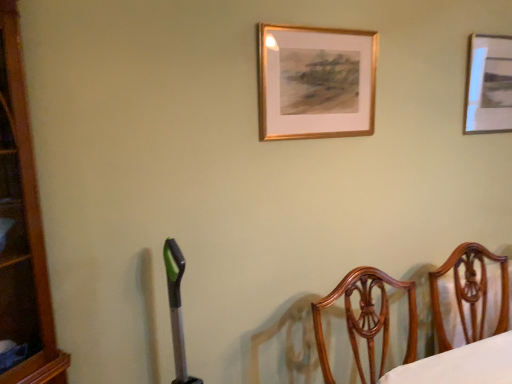
Question: From the image's perspective, is wooden chair at right under gold wooden picture frame at upper center, the 2th picture frame positioned from the right?

Choices:
 (A) no
 (B) yes

Answer: (B)

Question: Can you confirm if wooden chair at right is smaller than gold wooden picture frame at upper center, the 2th picture frame positioned from the right?

Choices:
 (A) yes
 (B) no

Answer: (B)

Question: Is wooden chair at right facing away from gold wooden picture frame at upper center, the second picture frame when ordered from back to front?

Choices:
 (A) yes
 (B) no

Answer: (B)

Question: Is wooden chair at right behind gold wooden picture frame at upper center, the 2th picture frame positioned from the right?

Choices:
 (A) yes
 (B) no

Answer: (B)

Question: Considering the relative positions of wooden chair at right and gold wooden picture frame at upper center, the 2th picture frame positioned from the right, in the image provided, is wooden chair at right to the left of gold wooden picture frame at upper center, the 2th picture frame positioned from the right, from the viewer's perspective?

Choices:
 (A) yes
 (B) no

Answer: (B)

Question: Is wooden chair at right not inside gold wooden picture frame at upper center, the second picture frame when ordered from back to front?

Choices:
 (A) no
 (B) yes

Answer: (B)

Question: Considering the relative positions of gold wooden picture frame at upper center, the second picture frame when ordered from back to front, and wooden chair at right in the image provided, is gold wooden picture frame at upper center, the second picture frame when ordered from back to front, to the left of wooden chair at right from the viewer's perspective?

Choices:
 (A) no
 (B) yes

Answer: (B)

Question: From the image's perspective, is gold wooden picture frame at upper center, which appears as the first picture frame when viewed from the front, located above wooden chair at right?

Choices:
 (A) no
 (B) yes

Answer: (B)

Question: Is gold wooden picture frame at upper center, the second picture frame when ordered from back to front, thinner than wooden chair at right?

Choices:
 (A) no
 (B) yes

Answer: (B)

Question: Can you confirm if gold wooden picture frame at upper center, the 2th picture frame positioned from the right, is shorter than wooden chair at right?

Choices:
 (A) no
 (B) yes

Answer: (B)

Question: Is gold wooden picture frame at upper center, the second picture frame when ordered from back to front, located outside wooden chair at right?

Choices:
 (A) no
 (B) yes

Answer: (B)

Question: Is gold wooden picture frame at upper center, which appears as the first picture frame when viewed from the front, at the right side of wooden chair at right?

Choices:
 (A) yes
 (B) no

Answer: (B)

Question: From a real-world perspective, is metallic silver picture frame at upper right, which ranks as the 1th picture frame in back-to-front order, positioned under gold wooden picture frame at upper center, the second picture frame when ordered from back to front, based on gravity?

Choices:
 (A) no
 (B) yes

Answer: (A)